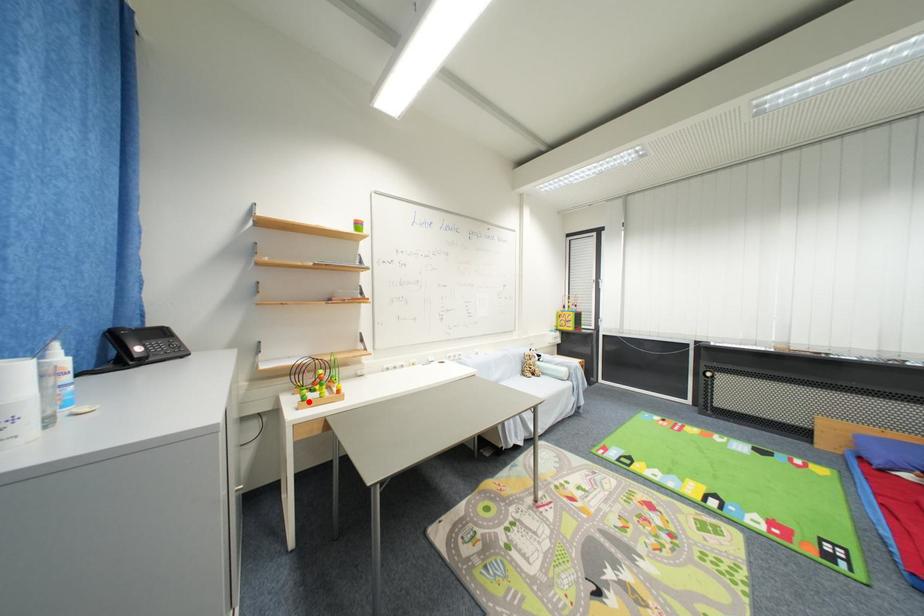
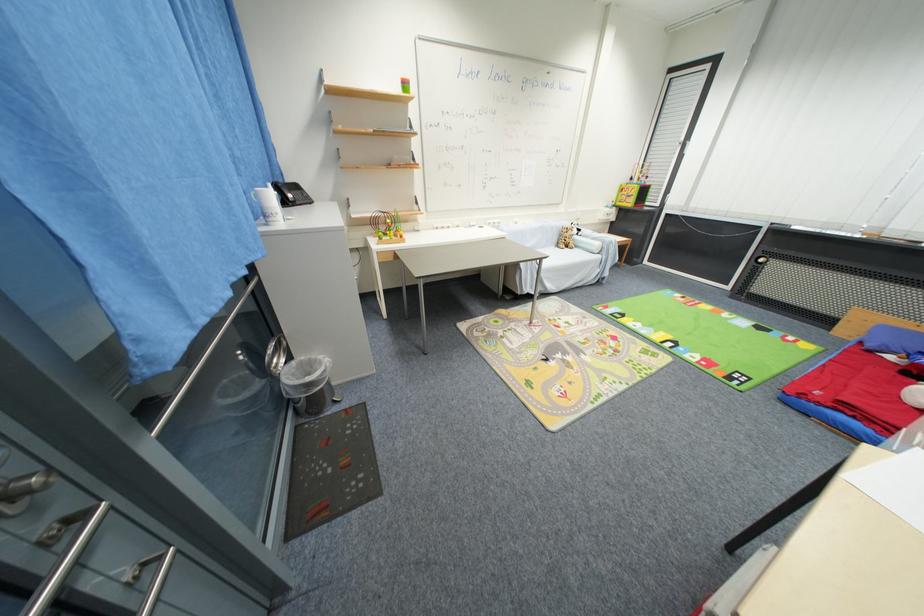
Question: I am providing you with two images of the same scene from different viewpoints. A red point is shown in image1. For the corresponding object point in image2, is it positioned nearer or farther from the camera?

Choices:
 (A) Nearer
 (B) Farther

Answer: (A)